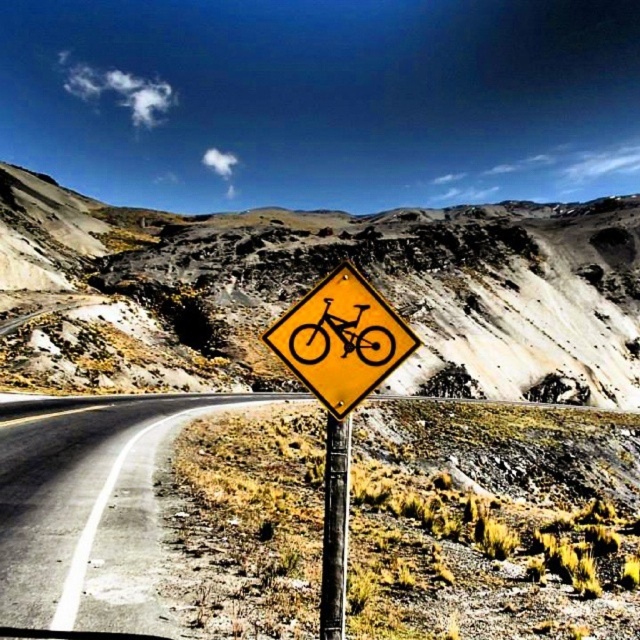
Is yellow diamond sign at center smaller than metallic pole at center?

No, yellow diamond sign at center is not smaller than metallic pole at center.

Does yellow diamond sign at center appear under metallic pole at center?

Incorrect, yellow diamond sign at center is not positioned below metallic pole at center.

Is point (556, 266) positioned before point (337, 625)?

No, it is not.

The height and width of the screenshot is (640, 640). Find the location of `yellow diamond sign at center`. yellow diamond sign at center is located at coordinates (314, 284).

Does yellow matte bicycle sign at center come in front of metallic pole at center?

Yes, yellow matte bicycle sign at center is in front of metallic pole at center.

Is yellow matte bicycle sign at center further to camera compared to metallic pole at center?

No, yellow matte bicycle sign at center is closer to the viewer.

This screenshot has height=640, width=640. I want to click on yellow matte bicycle sign at center, so click(x=340, y=339).

Is asphalt road at center above yellow matte sign at center?

Yes, asphalt road at center is above yellow matte sign at center.

Does point (20, 500) come farther from viewer compared to point (292, 348)?

Yes.

Where is `asphalt road at center`? The width and height of the screenshot is (640, 640). asphalt road at center is located at coordinates (90, 518).

Locate an element on the screen. This screenshot has height=640, width=640. asphalt road at center is located at coordinates (90, 518).